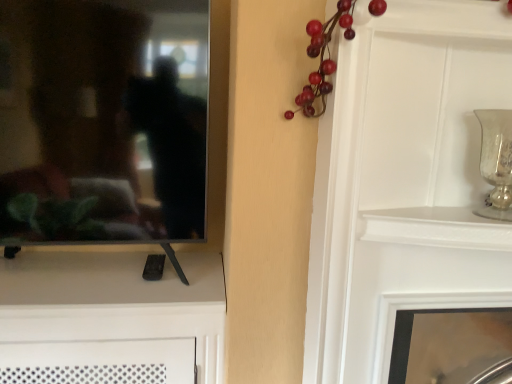
Question: In the image, is white glossy fireplace at lower right on the left side or the right side of silver textured vase at upper right?

Choices:
 (A) right
 (B) left

Answer: (A)

Question: Is point (493, 292) positioned closer to the camera than point (494, 145)?

Choices:
 (A) farther
 (B) closer

Answer: (A)

Question: Which object is the farthest from the black glossy mirror at left?

Choices:
 (A) white glossy fireplace at lower right
 (B) silver textured vase at upper right

Answer: (B)

Question: Estimate the real-world distances between objects in this image. Which object is closer to the white glossy fireplace at lower right?

Choices:
 (A) black glossy mirror at left
 (B) silver textured vase at upper right

Answer: (B)